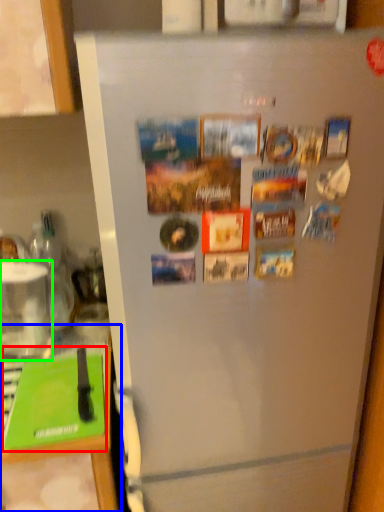
Question: Which is nearer to the magazine (highlighted by a red box)? counter top (highlighted by a blue box) or appliance (highlighted by a green box).

Choices:
 (A) counter top
 (B) appliance

Answer: (A)